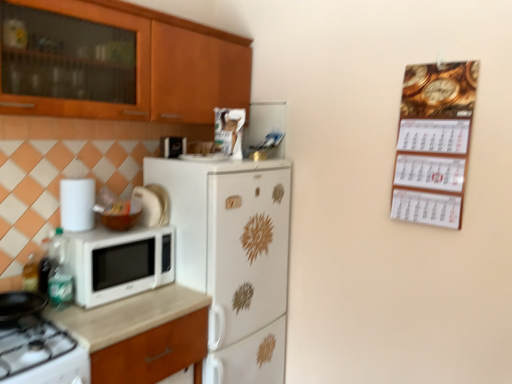
Question: Is white matte microwave at left looking in the opposite direction of white glossy refrigerator at center?

Choices:
 (A) no
 (B) yes

Answer: (A)

Question: Is white matte microwave at left at the left side of white glossy refrigerator at center?

Choices:
 (A) yes
 (B) no

Answer: (A)

Question: Is the position of white matte microwave at left more distant than that of white glossy refrigerator at center?

Choices:
 (A) yes
 (B) no

Answer: (B)

Question: Is white matte microwave at left aimed at white glossy refrigerator at center?

Choices:
 (A) no
 (B) yes

Answer: (A)

Question: Is white matte microwave at left smaller than white glossy refrigerator at center?

Choices:
 (A) no
 (B) yes

Answer: (B)

Question: Is gold metallic calendar at upper right taller or shorter than white glossy gas stove at lower left?

Choices:
 (A) short
 (B) tall

Answer: (B)

Question: Based on their positions, is gold metallic calendar at upper right located to the left or right of white glossy gas stove at lower left?

Choices:
 (A) left
 (B) right

Answer: (B)

Question: Is gold metallic calendar at upper right inside the boundaries of white glossy gas stove at lower left, or outside?

Choices:
 (A) inside
 (B) outside

Answer: (B)

Question: From a real-world perspective, is gold metallic calendar at upper right positioned above or below white glossy gas stove at lower left?

Choices:
 (A) below
 (B) above

Answer: (B)

Question: Is white glossy microwave at left, which is counted as the second appliance, starting from the front, inside or outside of gold metallic calendar at upper right?

Choices:
 (A) outside
 (B) inside

Answer: (A)

Question: Visually, is white glossy microwave at left, arranged as the second appliance when viewed from the right, positioned to the left or to the right of gold metallic calendar at upper right?

Choices:
 (A) left
 (B) right

Answer: (A)

Question: Considering their positions, is white glossy microwave at left, marked as the 1th appliance in a bottom-to-top arrangement, located in front of or behind gold metallic calendar at upper right?

Choices:
 (A) behind
 (B) front

Answer: (A)

Question: Looking at their shapes, would you say white glossy microwave at left, the second appliance from the back, is wider or thinner than gold metallic calendar at upper right?

Choices:
 (A) thin
 (B) wide

Answer: (B)

Question: Is white glossy refrigerator at center spatially inside white matte microwave at left, or outside of it?

Choices:
 (A) outside
 (B) inside

Answer: (A)

Question: Considering the positions of point (245, 173) and point (103, 284), is point (245, 173) closer or farther from the camera than point (103, 284)?

Choices:
 (A) farther
 (B) closer

Answer: (A)